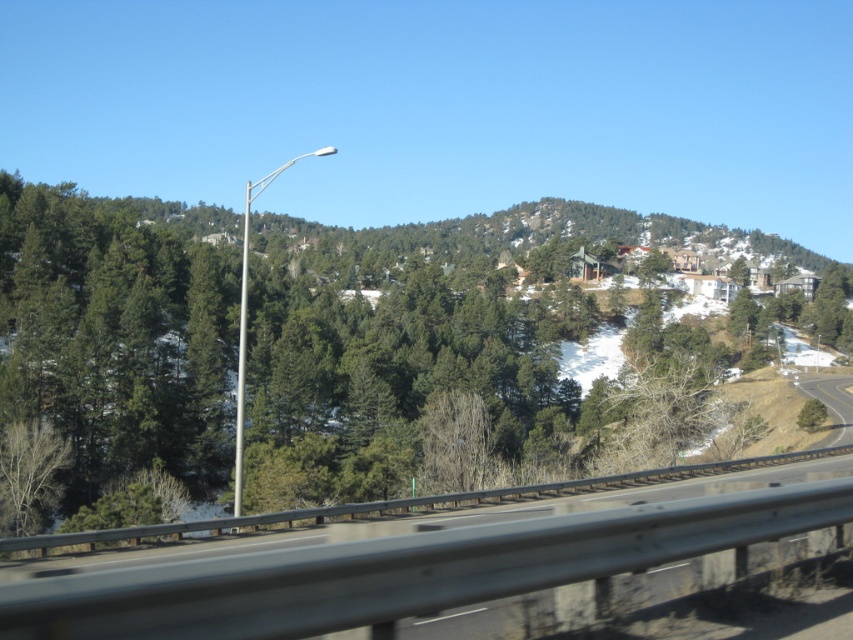
Which of these two, metallic gray highway at center or metallic pole at center, stands taller?

metallic pole at center

Who is more forward, (252, 621) or (238, 476)?

Positioned in front is point (252, 621).

Is point (294, 604) positioned before point (242, 435)?

Yes, it is.

Identify the location of metallic gray highway at center. (404, 570).

Where is `green evergreen tree at center`? This screenshot has height=640, width=853. green evergreen tree at center is located at coordinates (451, 381).

What do you see at coordinates (451, 381) in the screenshot? I see `green evergreen tree at center` at bounding box center [451, 381].

Describe the element at coordinates (451, 381) in the screenshot. The image size is (853, 640). I see `green evergreen tree at center` at that location.

Where is `green evergreen tree at center`? green evergreen tree at center is located at coordinates (451, 381).

Can you confirm if metallic gray highway at center is bigger than silver metallic street light at center-left?

Actually, metallic gray highway at center might be smaller than silver metallic street light at center-left.

Is point (543, 582) behind point (239, 444)?

No.

Does point (160, 612) lie in front of point (241, 493)?

Yes, point (160, 612) is in front of point (241, 493).

Find the location of a particular element. metallic gray highway at center is located at coordinates (404, 570).